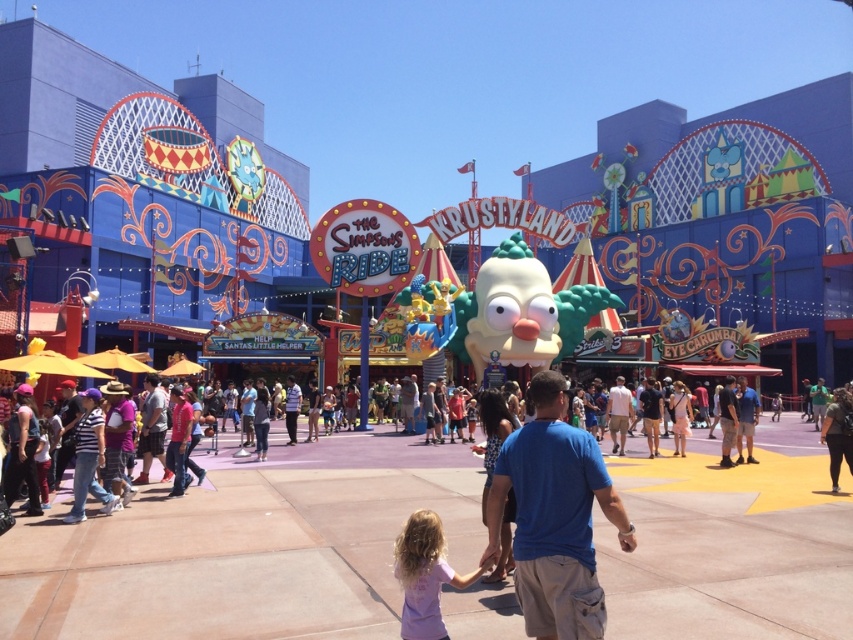
You are a photographer at the theme park and want to capture both the pink fabric dress at lower center and the light blue shirt at center in a single shot. Since you want to highlight the smaller item, which one should you focus on to ensure it stands out more?

The pink fabric dress at lower center has a lesser width compared to light blue shirt at center, so focusing on the pink fabric dress at lower center will make it stand out more as it is smaller and requires attention to detail.

You are standing at the entrance of Krustyland and see two shirts in the center area. The light blue shirt at center and the striped shirt at center. Which shirt is closer to you?

The light blue shirt at center is 34.20 meters away from striped shirt at center, so the striped shirt at center is closer to you.